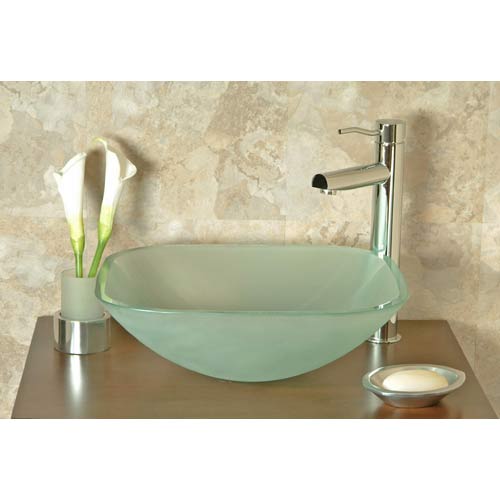
Where is `cup`? cup is located at coordinates coord(83,305).